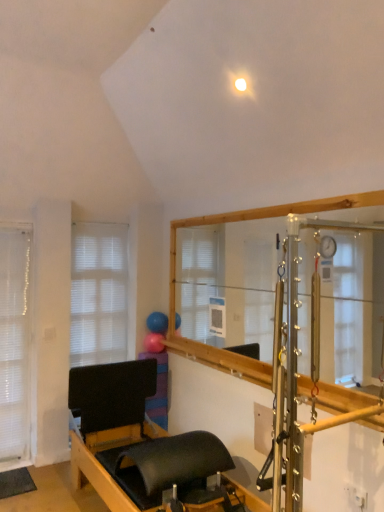
Measure the distance between point (150, 329) and camera.

Point (150, 329) is 3.89 meters from camera.

Describe the element at coordinates (14, 342) in the screenshot. I see `white sheer curtain at left` at that location.

Image resolution: width=384 pixels, height=512 pixels. What do you see at coordinates (154, 343) in the screenshot?
I see `rubber ball at upper center, acting as the 2th balloon starting from the top` at bounding box center [154, 343].

What is the approximate width of white matte window at left?

white matte window at left is 2.18 inches wide.

Measure the distance between point [98,240] and camera.

They are 3.96 meters apart.

Describe the element at coordinates (154, 469) in the screenshot. I see `black matte bed frame at lower center` at that location.

Where is `blue rubber balloon at center, placed as the second balloon when sorted from bottom to top`? blue rubber balloon at center, placed as the second balloon when sorted from bottom to top is located at coordinates (157, 322).

In terms of size, does white sheer curtain at left appear bigger or smaller than black matte bed frame at lower center?

Considering their sizes, white sheer curtain at left takes up less space than black matte bed frame at lower center.

Which is behind, white sheer curtain at left or black matte bed frame at lower center?

white sheer curtain at left is further from the camera.

Can you confirm if white sheer curtain at left is taller than black matte bed frame at lower center?

Yes, white sheer curtain at left is taller than black matte bed frame at lower center.

In terms of height, does rubber ball at upper center, acting as the 2th balloon starting from the top, look taller or shorter compared to white matte window at left?

Clearly, rubber ball at upper center, acting as the 2th balloon starting from the top, is shorter compared to white matte window at left.

Is rubber ball at upper center, acting as the 2th balloon starting from the top, inside the boundaries of white matte window at left, or outside?

rubber ball at upper center, acting as the 2th balloon starting from the top, lies outside white matte window at left.

Does point (146, 341) appear closer or farther from the camera than point (115, 291)?

Point (146, 341) is positioned closer to the camera compared to point (115, 291).

Between rubber ball at upper center, the first balloon when ordered from bottom to top, and white matte window at left, which one has smaller size?

rubber ball at upper center, the first balloon when ordered from bottom to top.

From the image's perspective, would you say rubber ball at upper center, acting as the 2th balloon starting from the top, is shown under black matte bed frame at lower center?

Actually, rubber ball at upper center, acting as the 2th balloon starting from the top, appears above black matte bed frame at lower center in the image.

What's the angular difference between rubber ball at upper center, the first balloon when ordered from bottom to top, and black matte bed frame at lower center's facing directions?

There is a 87.8-degree angle between the facing directions of rubber ball at upper center, the first balloon when ordered from bottom to top, and black matte bed frame at lower center.

Is rubber ball at upper center, the first balloon when ordered from bottom to top, completely or partially outside of black matte bed frame at lower center?

Indeed, rubber ball at upper center, the first balloon when ordered from bottom to top, is completely outside black matte bed frame at lower center.

Considering the positions of objects rubber ball at upper center, the first balloon when ordered from bottom to top, and black matte bed frame at lower center in the image provided, who is more to the right, rubber ball at upper center, the first balloon when ordered from bottom to top, or black matte bed frame at lower center?

Positioned to the right is rubber ball at upper center, the first balloon when ordered from bottom to top.

Could you measure the distance between blue rubber balloon at center, which ranks as the first balloon in top-to-bottom order, and black matte bed frame at lower center?

The distance of blue rubber balloon at center, which ranks as the first balloon in top-to-bottom order, from black matte bed frame at lower center is 1.41 meters.

In the scene shown: How different are the orientations of blue rubber balloon at center, placed as the second balloon when sorted from bottom to top, and black matte bed frame at lower center in degrees?

blue rubber balloon at center, placed as the second balloon when sorted from bottom to top, and black matte bed frame at lower center are facing 87.8 degrees away from each other.

Does blue rubber balloon at center, which ranks as the first balloon in top-to-bottom order, have a greater height compared to black matte bed frame at lower center?

Yes.

In the scene shown: From the image's perspective, would you say blue rubber balloon at center, placed as the second balloon when sorted from bottom to top, is positioned over black matte bed frame at lower center?

Yes, from the image's perspective, blue rubber balloon at center, placed as the second balloon when sorted from bottom to top, is on top of black matte bed frame at lower center.

Is there a large distance between white matte window at left and blue rubber balloon at center, which ranks as the first balloon in top-to-bottom order?

No, white matte window at left is in close proximity to blue rubber balloon at center, which ranks as the first balloon in top-to-bottom order.

Is white matte window at left looking in the opposite direction of blue rubber balloon at center, placed as the second balloon when sorted from bottom to top?

No, white matte window at left is not facing away from blue rubber balloon at center, placed as the second balloon when sorted from bottom to top.

Locate an element on the screen. Image resolution: width=384 pixels, height=512 pixels. window in front of the blue rubber balloon at center, which ranks as the first balloon in top-to-bottom order is located at coordinates (98, 294).

Which is closer, (98, 345) or (158, 323)?

Point (98, 345).

From the picture: Could you tell me if blue rubber balloon at center, which ranks as the first balloon in top-to-bottom order, is facing white sheer curtain at left?

Yes.

The height and width of the screenshot is (512, 384). I want to click on blind below the blue rubber balloon at center, placed as the second balloon when sorted from bottom to top (from the image's perspective), so click(x=14, y=342).

How many degrees apart are the facing directions of blue rubber balloon at center, placed as the second balloon when sorted from bottom to top, and white sheer curtain at left?

There is a 92-degree angle between the facing directions of blue rubber balloon at center, placed as the second balloon when sorted from bottom to top, and white sheer curtain at left.

Is blue rubber balloon at center, which ranks as the first balloon in top-to-bottom order, inside or outside of white sheer curtain at left?

blue rubber balloon at center, which ranks as the first balloon in top-to-bottom order, exists outside the volume of white sheer curtain at left.

Does white matte window at left have a larger size compared to black matte bed frame at lower center?

Actually, white matte window at left might be smaller than black matte bed frame at lower center.

Is white matte window at left spatially inside black matte bed frame at lower center, or outside of it?

white matte window at left cannot be found inside black matte bed frame at lower center.

From the image's perspective, is white matte window at left on black matte bed frame at lower center?

Yes.

From a real-world perspective, is white matte window at left on black matte bed frame at lower center?

Yes, from a real-world perspective, white matte window at left is over black matte bed frame at lower center

At what (x,y) coordinates should I click in order to perform the action: click on blind above the black matte bed frame at lower center (from the image's perspective). Please return your answer as a coordinate pair (x, y). Image resolution: width=384 pixels, height=512 pixels. Looking at the image, I should click on (14, 342).

Find the location of a particular element. The width and height of the screenshot is (384, 512). the 1st balloon to the right when counting from the white matte window at left is located at coordinates (154, 343).

Which object lies nearer to the anchor point white matte window at left, blue rubber balloon at center, which ranks as the first balloon in top-to-bottom order, or rubber ball at upper center, acting as the 2th balloon starting from the top?

blue rubber balloon at center, which ranks as the first balloon in top-to-bottom order, lies closer to white matte window at left than the other object.

Which object lies further to the anchor point rubber ball at upper center, the first balloon when ordered from bottom to top, white matte window at left or black matte bed frame at lower center?

black matte bed frame at lower center is positioned further to the anchor rubber ball at upper center, the first balloon when ordered from bottom to top.

Looking at the image, which one is located closer to black matte bed frame at lower center, white matte window at left or blue rubber balloon at center, placed as the second balloon when sorted from bottom to top?

white matte window at left lies closer to black matte bed frame at lower center than the other object.

Which object lies further to the anchor point rubber ball at upper center, acting as the 2th balloon starting from the top, white matte window at left or white sheer curtain at left?

white sheer curtain at left lies further to rubber ball at upper center, acting as the 2th balloon starting from the top, than the other object.

Based on their spatial positions, is white matte window at left or rubber ball at upper center, the first balloon when ordered from bottom to top, further from black matte bed frame at lower center?

The object further to black matte bed frame at lower center is white matte window at left.

From the image, which object appears to be farther from blue rubber balloon at center, placed as the second balloon when sorted from bottom to top, white matte window at left or black matte bed frame at lower center?

black matte bed frame at lower center is further to blue rubber balloon at center, placed as the second balloon when sorted from bottom to top.

Based on their spatial positions, is white matte window at left or blue rubber balloon at center, placed as the second balloon when sorted from bottom to top, further from white sheer curtain at left?

blue rubber balloon at center, placed as the second balloon when sorted from bottom to top, lies further to white sheer curtain at left than the other object.

Looking at the image, which one is located further to white matte window at left, rubber ball at upper center, acting as the 2th balloon starting from the top, or blue rubber balloon at center, which ranks as the first balloon in top-to-bottom order?

Based on the image, rubber ball at upper center, acting as the 2th balloon starting from the top, appears to be further to white matte window at left.

Where is `window between white sheer curtain at left and rubber ball at upper center, acting as the 2th balloon starting from the top, in the horizontal direction`? The image size is (384, 512). window between white sheer curtain at left and rubber ball at upper center, acting as the 2th balloon starting from the top, in the horizontal direction is located at coordinates (98, 294).

Identify the location of balloon situated between white matte window at left and blue rubber balloon at center, which ranks as the first balloon in top-to-bottom order, from left to right. [x=154, y=343].

Where is `balloon located between black matte bed frame at lower center and rubber ball at upper center, the first balloon when ordered from bottom to top, in the depth direction`? This screenshot has height=512, width=384. balloon located between black matte bed frame at lower center and rubber ball at upper center, the first balloon when ordered from bottom to top, in the depth direction is located at coordinates (157, 322).

Locate an element on the screen. The width and height of the screenshot is (384, 512). balloon between white sheer curtain at left and blue rubber balloon at center, which ranks as the first balloon in top-to-bottom order, in the horizontal direction is located at coordinates click(154, 343).